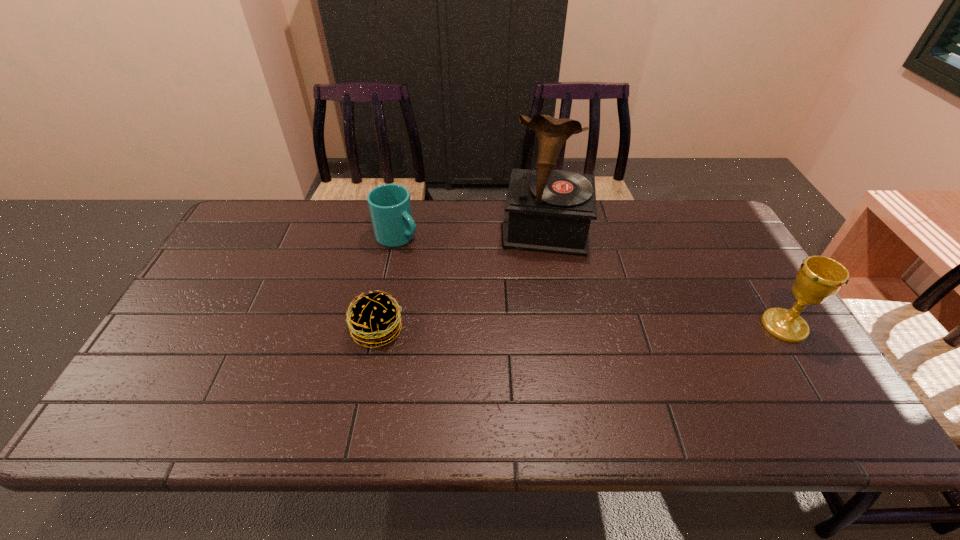
I want to click on the shortest object, so click(x=373, y=319).

Find the location of a particular element. The image size is (960, 540). the rightmost object is located at coordinates (818, 278).

The height and width of the screenshot is (540, 960). I want to click on the third shortest object, so click(818, 278).

Identify the location of the second object from right to left. This screenshot has width=960, height=540. (550, 211).

In order to click on phonograph_record in this screenshot , I will do `click(550, 211)`.

Locate an element on the screen. The image size is (960, 540). cup is located at coordinates (390, 208).

Where is `vacant space located on the left of the patty`? vacant space located on the left of the patty is located at coordinates (305, 330).

Image resolution: width=960 pixels, height=540 pixels. I want to click on vacant area situated on the back of the rightmost object, so click(x=722, y=226).

What are the coordinates of `free space located 0.140m at the horn opening of the third object from left to right` in the screenshot? It's located at (541, 291).

This screenshot has width=960, height=540. I want to click on blank space located 0.120m at the horn opening of the third object from left to right, so click(541, 286).